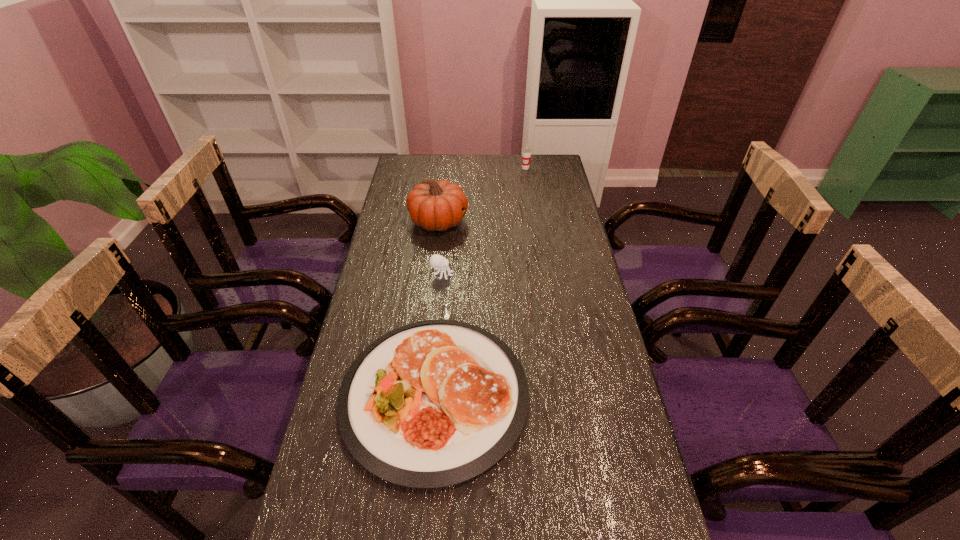
Locate an element on the screen. The width and height of the screenshot is (960, 540). empty location between the pumpkin and the cup is located at coordinates (482, 195).

Identify the location of free space between the cup and the second nearest object. The height and width of the screenshot is (540, 960). (484, 221).

Where is `empty location between the shortest object and the farthest object`? empty location between the shortest object and the farthest object is located at coordinates (480, 281).

In order to click on unoccupied position between the cup and the third tallest object in this screenshot , I will do `click(484, 221)`.

Where is `the third closest object relative to the second shortest object`? This screenshot has height=540, width=960. the third closest object relative to the second shortest object is located at coordinates (526, 151).

Where is `object that can be found as the closest to the farthest object`? object that can be found as the closest to the farthest object is located at coordinates (433, 205).

This screenshot has height=540, width=960. Find the location of `vacant point that satisfies the following two spatial constraints: 1. on the front-facing side of the third tallest object; 2. on the back side of the shortest object`. vacant point that satisfies the following two spatial constraints: 1. on the front-facing side of the third tallest object; 2. on the back side of the shortest object is located at coordinates (431, 395).

The width and height of the screenshot is (960, 540). Find the location of `vacant space that satisfies the following two spatial constraints: 1. on the front-facing side of the second shortest object; 2. on the left side of the dish`. vacant space that satisfies the following two spatial constraints: 1. on the front-facing side of the second shortest object; 2. on the left side of the dish is located at coordinates (431, 395).

Where is `vacant position in the image that satisfies the following two spatial constraints: 1. on the side of the cup with the logo; 2. on the front-facing side of the third farthest object`? This screenshot has width=960, height=540. vacant position in the image that satisfies the following two spatial constraints: 1. on the side of the cup with the logo; 2. on the front-facing side of the third farthest object is located at coordinates (541, 274).

Locate an element on the screen. This screenshot has width=960, height=540. blank area in the image that satisfies the following two spatial constraints: 1. on the back side of the dish; 2. on the front-facing side of the third farthest object is located at coordinates (444, 274).